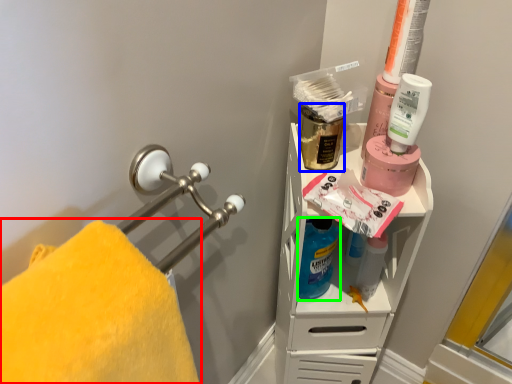
Question: Which is nearer to the towel (highlighted by a red box)? mouthwash (highlighted by a blue box) or cleaning product (highlighted by a green box).

Choices:
 (A) mouthwash
 (B) cleaning product

Answer: (B)